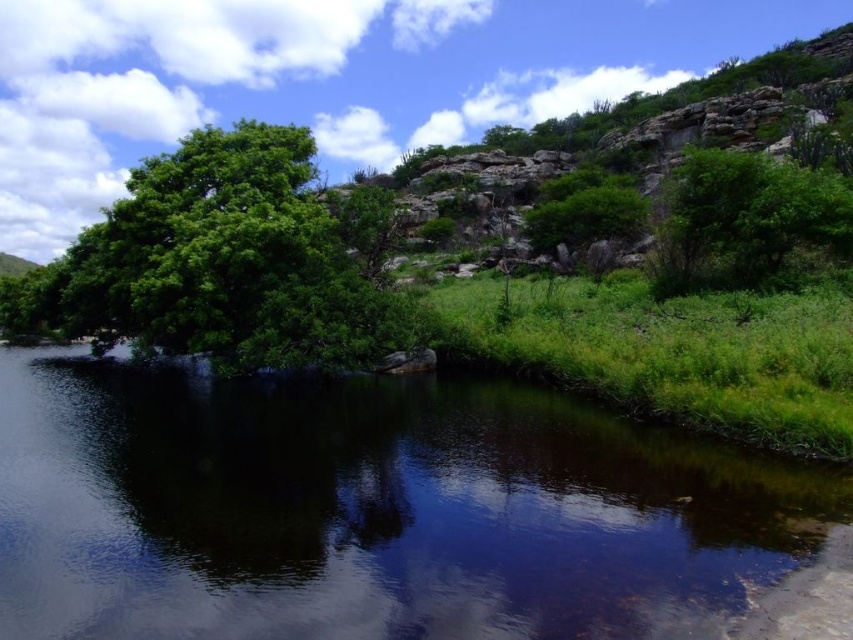
You are a hiker standing at the point with coordinates point (782, 218). You want to reach the point with coordinates point (361, 278). Is the destination visible from your current position?

Point (361, 278) is behind point (782, 218), so the destination is not visible from your current position.

You are standing at the base of the hill near the green leafy bush at upper right and want to cross to the other side of the green grassy river at center. Which direction should you walk to reach the river first?

You should walk downward towards the green grassy river at center since it is located below the green leafy bush at upper right.